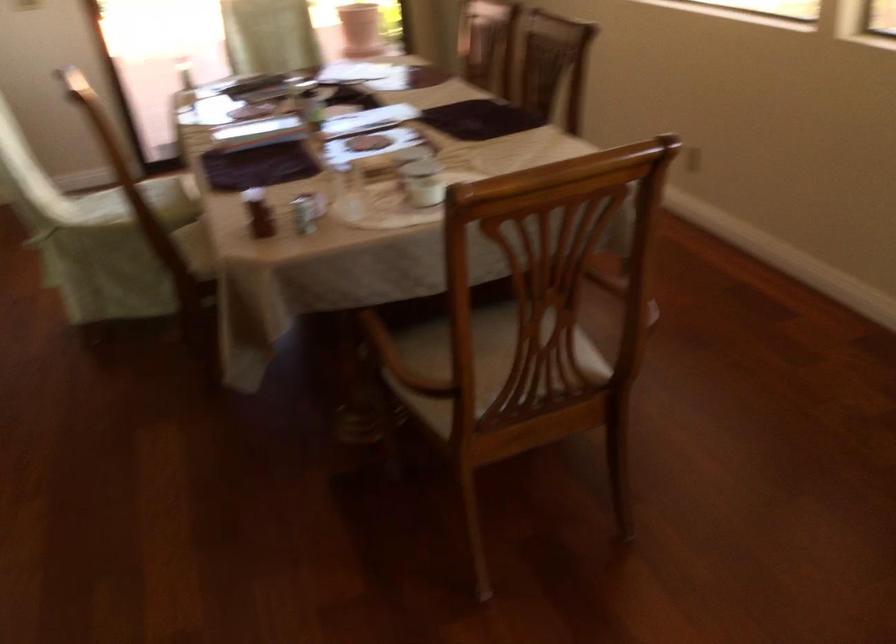
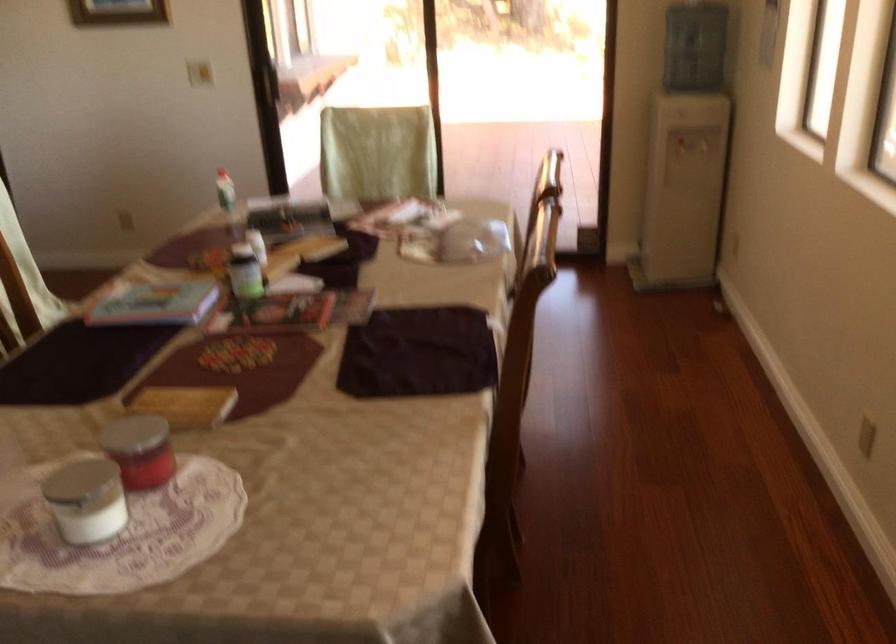
Find the pixel in the second image that matches the point at 424,176 in the first image.

(85, 500)